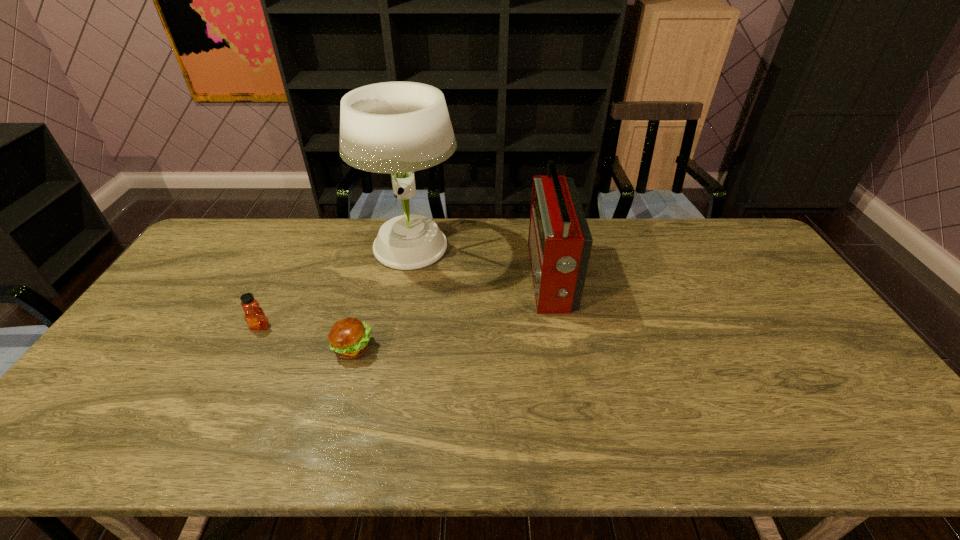
Where is `blank space located on the front label of the honey`? The width and height of the screenshot is (960, 540). blank space located on the front label of the honey is located at coordinates (228, 391).

The width and height of the screenshot is (960, 540). In order to click on vacant space located 0.380m on the right of the hamburger in this screenshot , I will do click(x=514, y=348).

Identify the location of lamp located in the far edge section of the desktop. The height and width of the screenshot is (540, 960). (397, 128).

This screenshot has height=540, width=960. I want to click on radio receiver located in the far edge section of the desktop, so point(559,241).

Find the location of a particular element. free spot at the far edge of the desktop is located at coordinates (273, 246).

In the image, there is a desktop. Identify the location of vacant area at the near edge. (722, 455).

Locate an element on the screen. vacant space at the right edge of the desktop is located at coordinates (760, 294).

In the image, there is a desktop. Where is `free region at the near left corner`? The height and width of the screenshot is (540, 960). free region at the near left corner is located at coordinates (108, 428).

Locate an element on the screen. This screenshot has width=960, height=540. vacant area between the second shortest object and the shortest object is located at coordinates (x=306, y=337).

Locate an element on the screen. This screenshot has width=960, height=540. unoccupied area between the second tallest object and the tallest object is located at coordinates (481, 264).